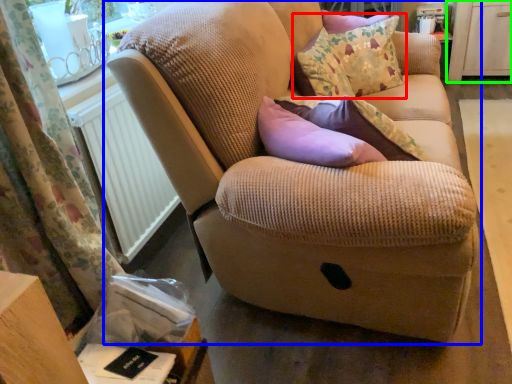
Question: Considering the real-world distances, which object is farthest from throw pillow (highlighted by a red box)? studio couch (highlighted by a blue box) or dresser (highlighted by a green box)?

Choices:
 (A) studio couch
 (B) dresser

Answer: (B)